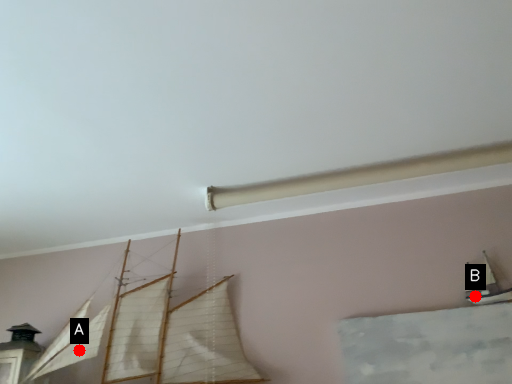
Question: Two points are circled on the image, labeled by A and B beside each circle. Which point is further to the camera?

Choices:
 (A) A is further
 (B) B is further

Answer: (A)